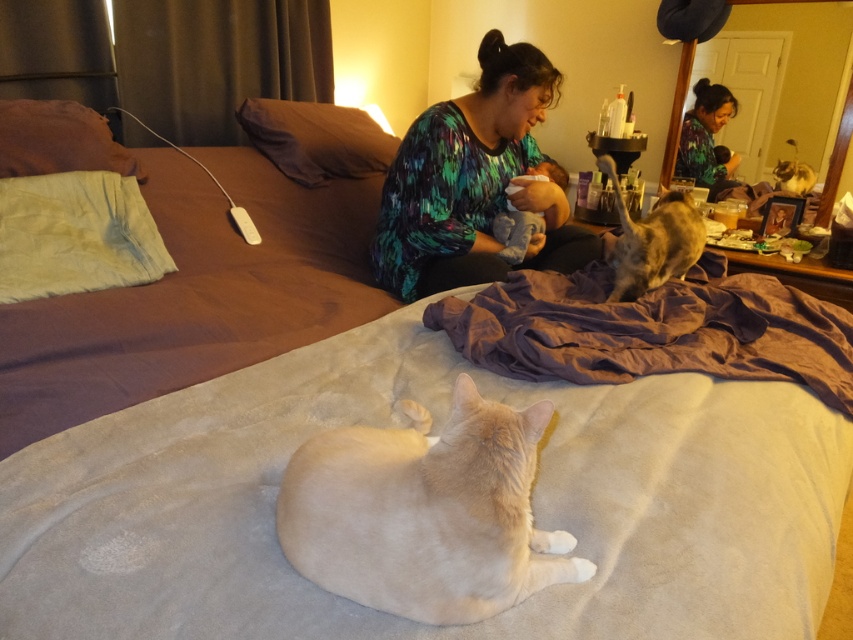
Is light beige fur cat at lower center thinner than tabby fur cat at upper right?

No.

Which is below, light beige fur cat at lower center or tabby fur cat at upper right?

Positioned lower is light beige fur cat at lower center.

Where is `light beige fur cat at lower center`? Image resolution: width=853 pixels, height=640 pixels. light beige fur cat at lower center is located at coordinates (425, 513).

Does brown fabric pillow at upper center appear under green printed shirt at upper center?

Indeed, brown fabric pillow at upper center is positioned under green printed shirt at upper center.

Who is higher up, brown fabric pillow at upper center or green printed shirt at upper center?

Positioned higher is green printed shirt at upper center.

The height and width of the screenshot is (640, 853). Find the location of `brown fabric pillow at upper center`. brown fabric pillow at upper center is located at coordinates (316, 138).

In order to click on brown fabric pillow at upper center in this screenshot , I will do `click(316, 138)`.

Based on the photo, measure the distance from multicolored printed shirt at center to white fabric pillow at upper left.

A distance of 32.93 inches exists between multicolored printed shirt at center and white fabric pillow at upper left.

Is multicolored printed shirt at center above white fabric pillow at upper left?

Correct, multicolored printed shirt at center is located above white fabric pillow at upper left.

Between point (546, 188) and point (80, 196), which one is positioned behind?

The point (546, 188) is behind.

This screenshot has width=853, height=640. What are the coordinates of `multicolored printed shirt at center` in the screenshot? It's located at (461, 173).